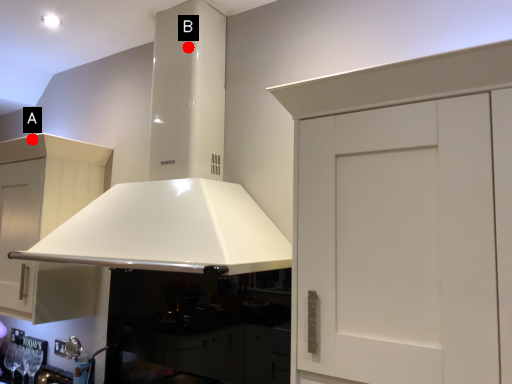
Question: Two points are circled on the image, labeled by A and B beside each circle. Which of the following is the closest to the observer?

Choices:
 (A) A is closer
 (B) B is closer

Answer: (B)